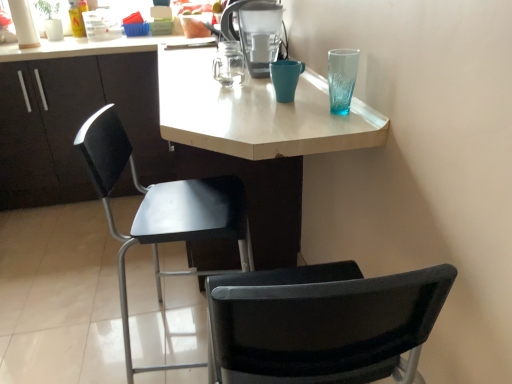
Identify the location of free space to the left of teal ceramic mug at upper center. (243, 102).